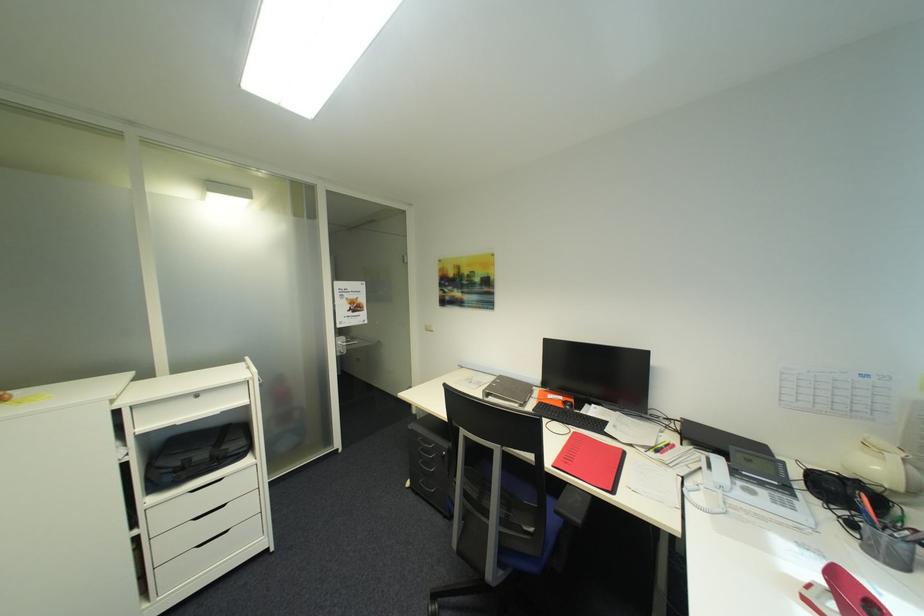
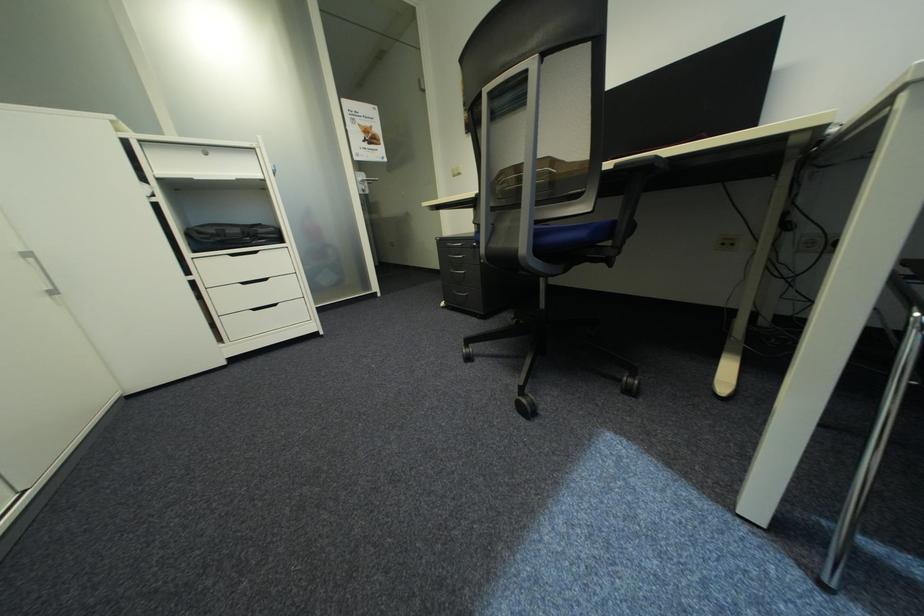
Question: Based on the continuous images, in which direction is the camera rotating? Reply with the corresponding letter.

Choices:
 (A) Left
 (B) Right
 (C) Up
 (D) Down

Answer: (D)